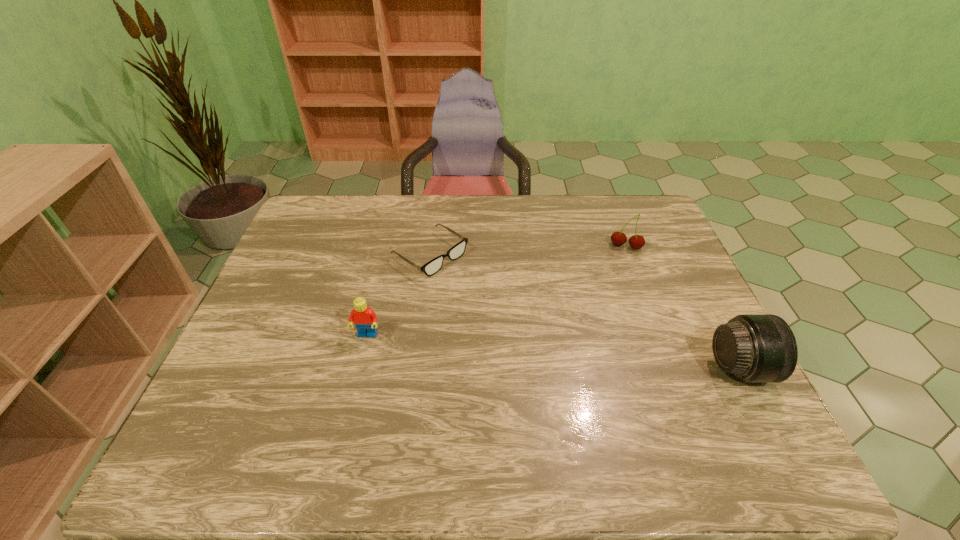
I want to click on vacant space that's between the shortest object and the third farthest object, so click(x=398, y=295).

Identify the location of vacant region between the telephoto lens and the spectacles. The image size is (960, 540). (585, 311).

Image resolution: width=960 pixels, height=540 pixels. What are the coordinates of `empty location between the shortest object and the second object from right to left` in the screenshot? It's located at pyautogui.click(x=528, y=251).

At what (x,y) coordinates should I click in order to perform the action: click on unoccupied area between the spectacles and the tallest object. Please return your answer as a coordinate pair (x, y). Image resolution: width=960 pixels, height=540 pixels. Looking at the image, I should click on (585, 311).

Find the location of `free space between the cherry and the rightmost object`. free space between the cherry and the rightmost object is located at coordinates (683, 307).

You are a GUI agent. You are given a task and a screenshot of the screen. Output one action in this format:
    pyautogui.click(x=<x>, y=<y>)
    Task: Click on the object that is the closest to the Lego
    
    Given the screenshot: What is the action you would take?
    [433, 266]

Point out which object is positioned as the third nearest to the spectacles. Please provide its 2D coordinates. Your answer should be formatted as a tuple, i.e. [(x, y)], where the tuple contains the x and y coordinates of a point satisfying the conditions above.

[(755, 348)]

Locate an element on the screen. vacant area in the image that satisfies the following two spatial constraints: 1. on the front side of the spectacles; 2. on the front-facing side of the telephoto lens is located at coordinates (416, 368).

At what (x,y) coordinates should I click in order to perform the action: click on free space that satisfies the following two spatial constraints: 1. on the front side of the second object from right to left; 2. on the front-facing side of the telephoto lens. Please return your answer as a coordinate pair (x, y). The height and width of the screenshot is (540, 960). Looking at the image, I should click on click(x=672, y=368).

Find the location of a particular element. The width and height of the screenshot is (960, 540). free location that satisfies the following two spatial constraints: 1. on the front side of the tallest object; 2. on the front-facing side of the cherry is located at coordinates (672, 368).